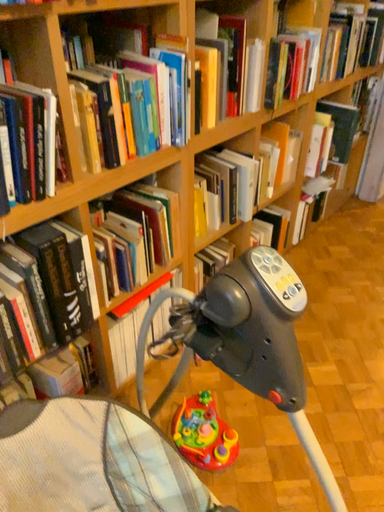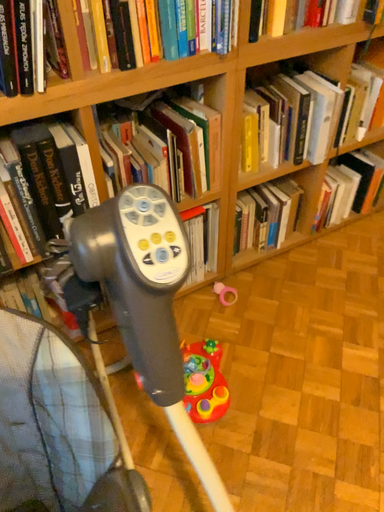
Question: How did the camera likely rotate when shooting the video?

Choices:
 (A) rotated downward
 (B) rotated upward

Answer: (A)